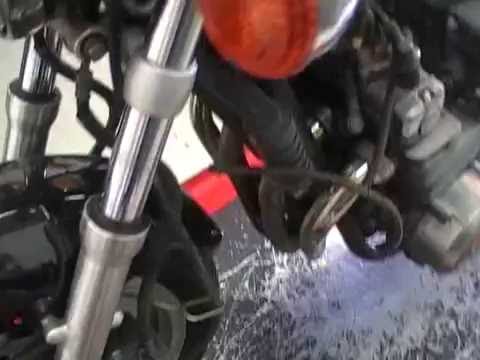
Where is `black and silver chipped paint floor`? Image resolution: width=480 pixels, height=360 pixels. black and silver chipped paint floor is located at coordinates (230, 226), (238, 281), (242, 336), (309, 334), (440, 329), (405, 293), (343, 272).